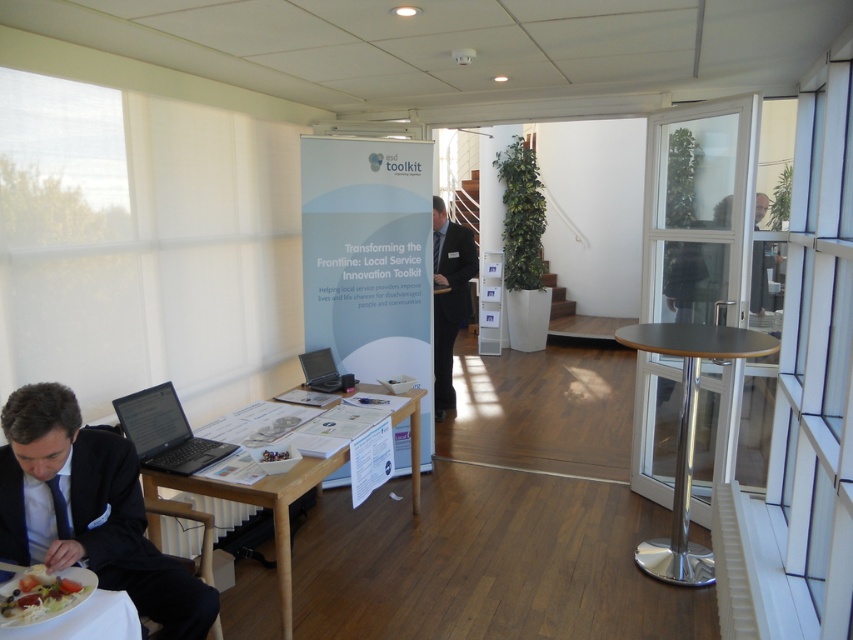
Based on the photo, you are a security guard in the room and need to reach both the black suit at center and the matte black laptop at center. Which object is closer to you?

The black suit at center is closer to you since it is 1.24 meters away from the matte black laptop at center, meaning the suit is nearer than the laptop.

You are organizing a meeting in this room and need to place a new decorative plant between the metallic gray table at right and the matte black laptop at lower left. Based on their positions, where should the plant be placed relative to the laptop?

The metallic gray table at right is located below the matte black laptop at lower left, so the plant should be placed between them, positioning it below the laptop and above the table.